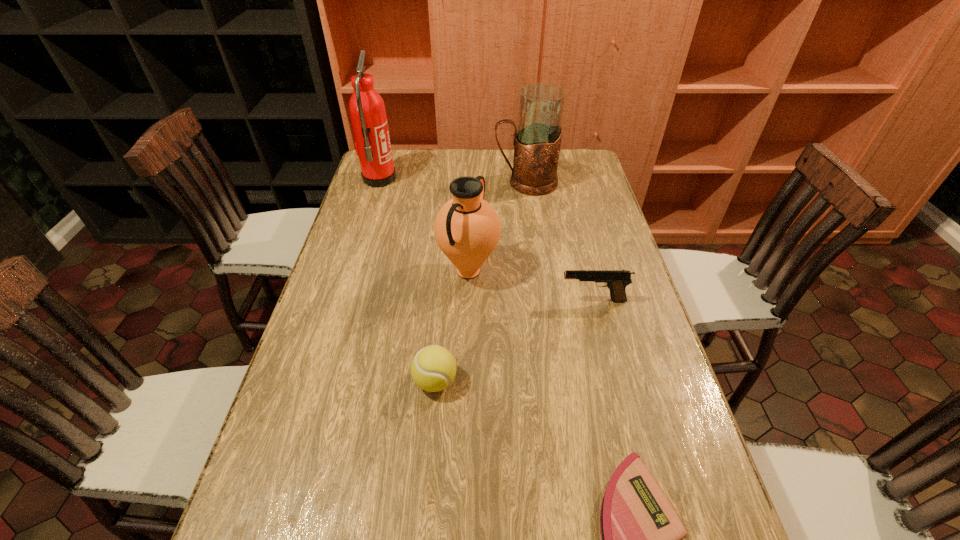
Identify the location of object situated at the far left corner. The height and width of the screenshot is (540, 960). [367, 110].

Where is `object that is at the far right corner`? object that is at the far right corner is located at coordinates (537, 139).

The width and height of the screenshot is (960, 540). Identify the location of free space at the far edge of the desktop. (505, 156).

Where is `vacant space at the left edge`? The image size is (960, 540). vacant space at the left edge is located at coordinates (394, 204).

In the image, there is a desktop. In order to click on blank space at the right edge in this screenshot , I will do `click(593, 353)`.

Where is `free spot between the fire extinguisher and the second nearest object`? This screenshot has width=960, height=540. free spot between the fire extinguisher and the second nearest object is located at coordinates (407, 280).

This screenshot has height=540, width=960. In order to click on vacant area that lies between the second nearest object and the third farthest object in this screenshot , I will do `click(452, 326)`.

This screenshot has height=540, width=960. Identify the location of vacant point located between the fifth farthest object and the pistol. (515, 341).

I want to click on unoccupied area between the fifth farthest object and the fourth farthest object, so click(x=515, y=341).

At what (x,y) coordinates should I click in order to perform the action: click on unoccupied area between the pistol and the nearer pitcher. Please return your answer as a coordinate pair (x, y). This screenshot has height=540, width=960. Looking at the image, I should click on (531, 286).